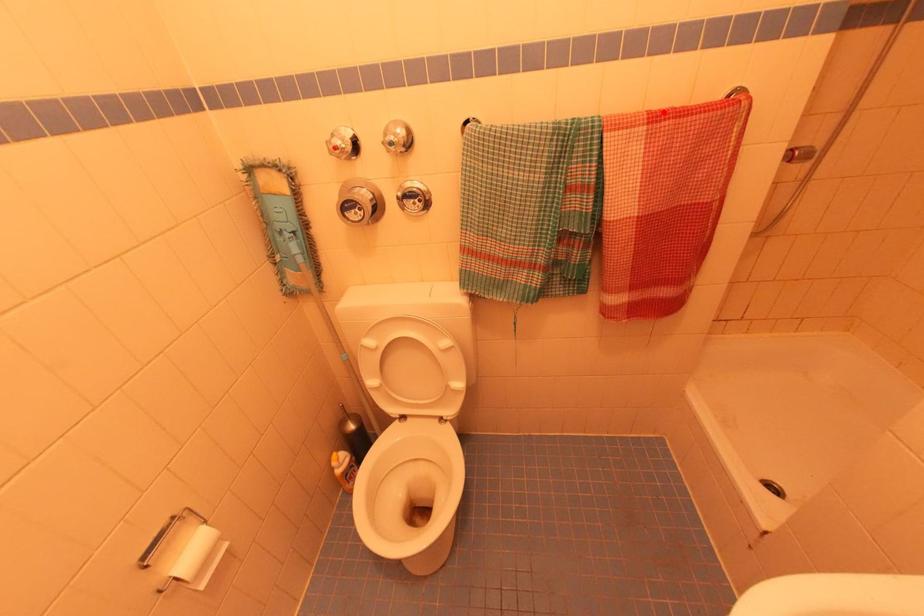
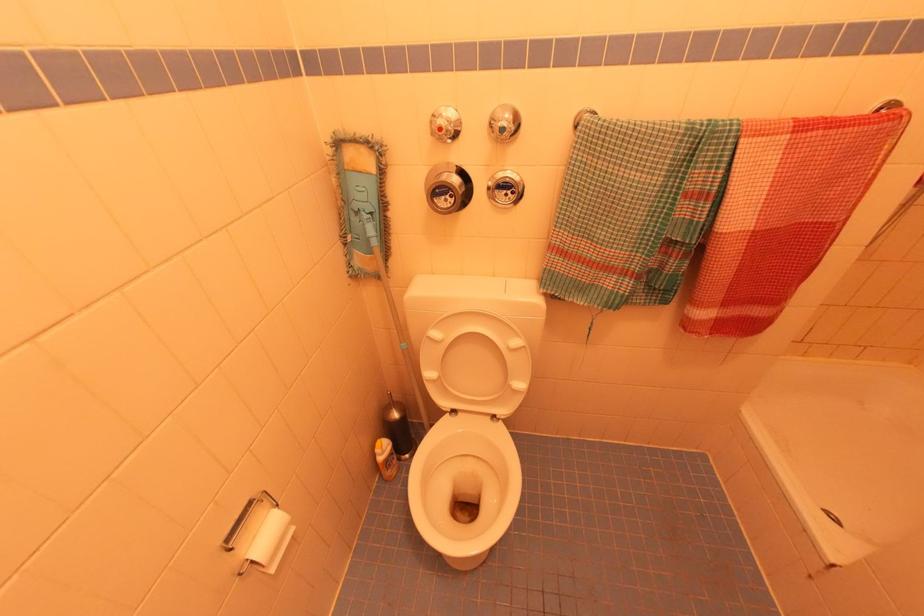
The point at the highlighted location is marked in the first image. Where is the corresponding point in the second image?

(812, 122)